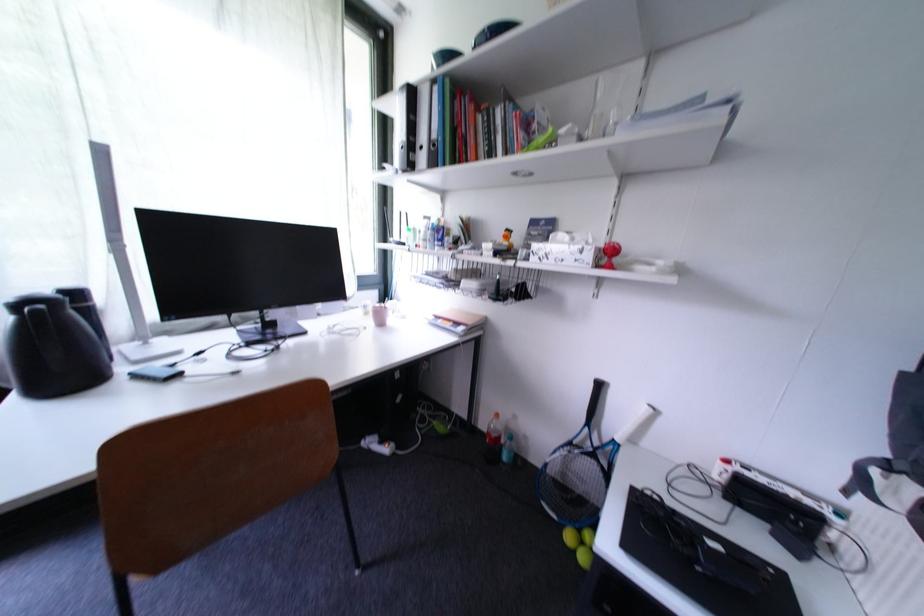
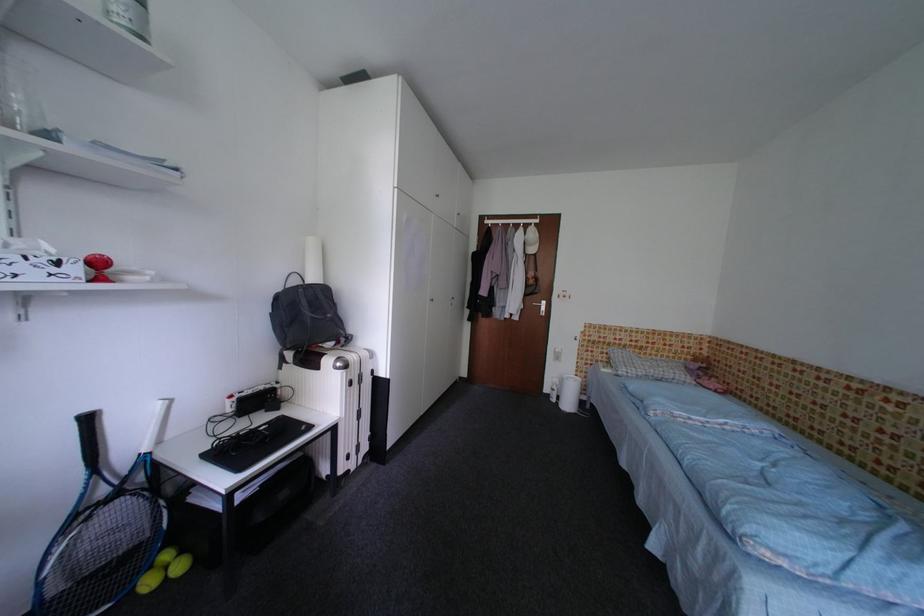
Locate, in the second image, the point that corresponds to the point at 608,387 in the first image.

(98, 422)